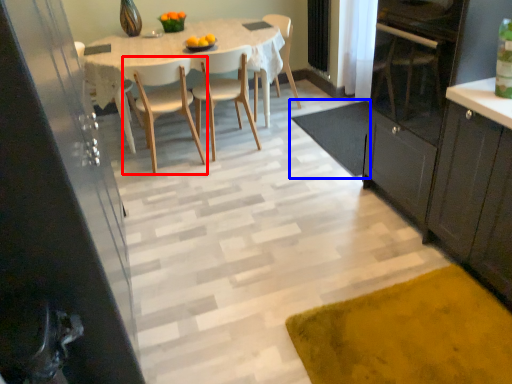
Question: Which of the following is the closest to the observer, chair (highlighted by a red box) or doormat (highlighted by a blue box)?

Choices:
 (A) chair
 (B) doormat

Answer: (A)